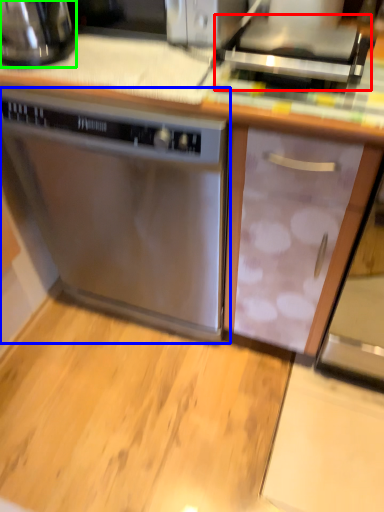
Question: Which object is positioned farthest from appliance (highlighted by a red box)? Select from home appliance (highlighted by a blue box) and kitchen appliance (highlighted by a green box).

Choices:
 (A) home appliance
 (B) kitchen appliance

Answer: (B)